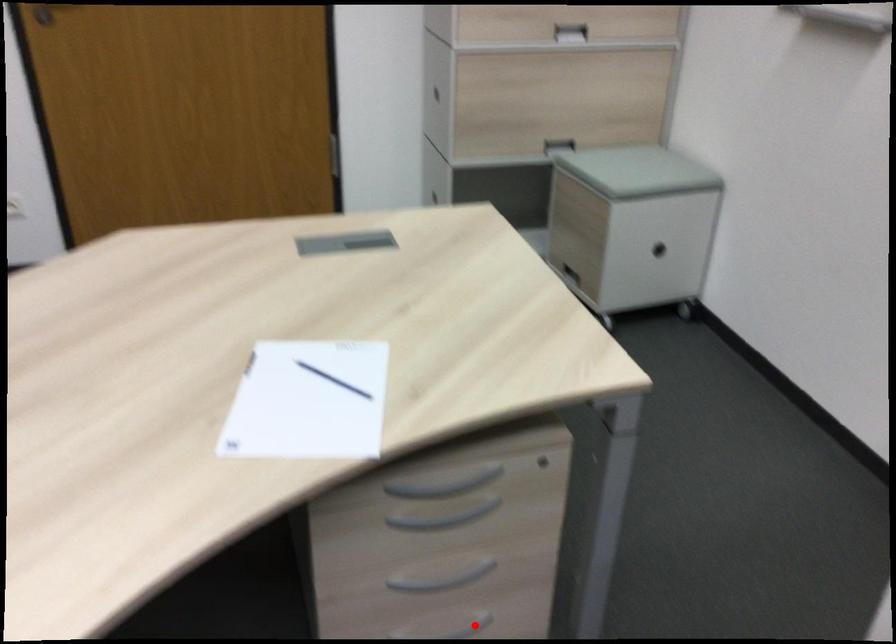
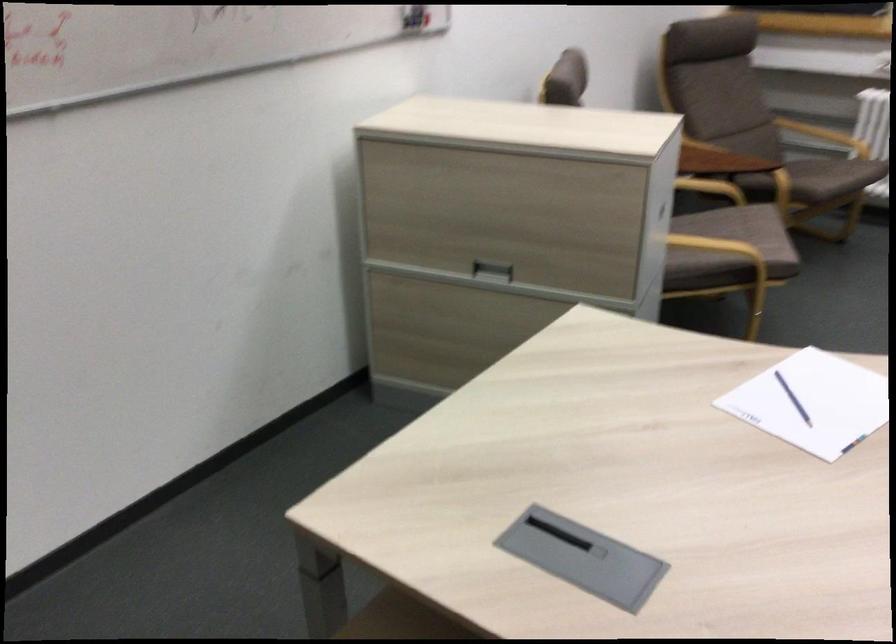
Question: I am providing you with two images of the same scene from different viewpoints. A red point is marked on the first image. At the location where the point appears in image 1, is it still visible in image 2?

Choices:
 (A) Yes
 (B) No

Answer: (B)